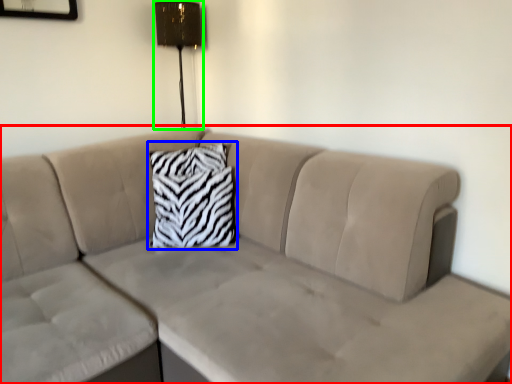
Question: Which object is the farthest from studio couch (highlighted by a red box)? Choose among these: pillow (highlighted by a blue box) or lamp (highlighted by a green box).

Choices:
 (A) pillow
 (B) lamp

Answer: (B)